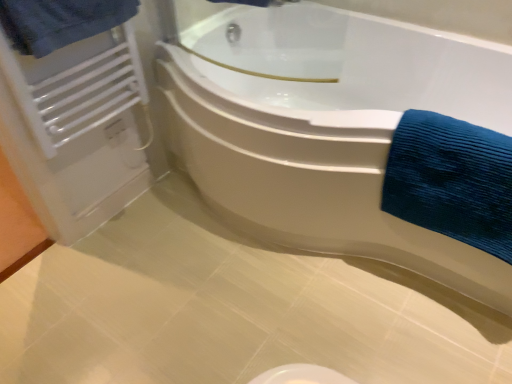
Question: Is white glossy bathtub at center completely or partially outside of blue textured towel at right, placed as the second bath towel when sorted from top to bottom?

Choices:
 (A) no
 (B) yes

Answer: (B)

Question: Are white glossy bathtub at center and blue textured towel at right, the 2th bath towel viewed from the left, located far from each other?

Choices:
 (A) yes
 (B) no

Answer: (B)

Question: Is white glossy bathtub at center aimed at blue textured towel at right, which ranks as the first bath towel in bottom-to-top order?

Choices:
 (A) no
 (B) yes

Answer: (B)

Question: Considering the relative sizes of white glossy bathtub at center and blue textured towel at right, placed as the second bath towel when sorted from top to bottom, in the image provided, is white glossy bathtub at center taller than blue textured towel at right, placed as the second bath towel when sorted from top to bottom,?

Choices:
 (A) no
 (B) yes

Answer: (B)

Question: Is white glossy bathtub at center bigger than blue textured towel at right, the 2th bath towel viewed from the left?

Choices:
 (A) no
 (B) yes

Answer: (B)

Question: Can you confirm if white glossy bathtub at center is smaller than blue textured towel at right, the 1th bath towel from the right?

Choices:
 (A) yes
 (B) no

Answer: (B)

Question: Does blue textured towel at right, the 1th bath towel from the right, appear on the right side of white metallic radiator at upper left?

Choices:
 (A) no
 (B) yes

Answer: (B)

Question: Does blue textured towel at right, the 2th bath towel viewed from the left, have a greater height compared to white metallic radiator at upper left?

Choices:
 (A) no
 (B) yes

Answer: (A)

Question: Is blue textured towel at right, the 1th bath towel from the right, closer to the viewer compared to white metallic radiator at upper left?

Choices:
 (A) no
 (B) yes

Answer: (B)

Question: Does blue textured towel at right, which ranks as the first bath towel in bottom-to-top order, have a smaller size compared to white metallic radiator at upper left?

Choices:
 (A) yes
 (B) no

Answer: (B)

Question: Can you confirm if blue textured towel at right, the 1th bath towel from the right, is positioned to the left of white metallic radiator at upper left?

Choices:
 (A) yes
 (B) no

Answer: (B)

Question: Considering the relative sizes of blue textured towel at right, which ranks as the first bath towel in bottom-to-top order, and white metallic radiator at upper left in the image provided, is blue textured towel at right, which ranks as the first bath towel in bottom-to-top order, wider than white metallic radiator at upper left?

Choices:
 (A) yes
 (B) no

Answer: (A)

Question: Considering the relative sizes of blue textured towel at right, the 2th bath towel viewed from the left, and white glossy bathtub at center in the image provided, is blue textured towel at right, the 2th bath towel viewed from the left, shorter than white glossy bathtub at center?

Choices:
 (A) yes
 (B) no

Answer: (A)